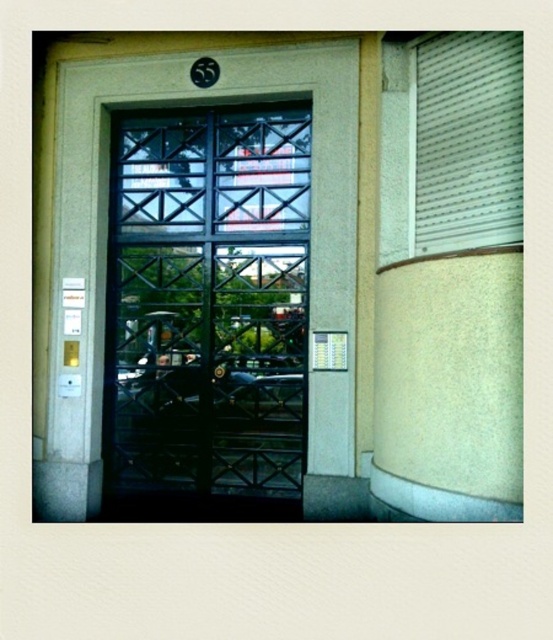
You are a delivery person trying to find the correct address. You see the beige textured pillar at right and the white plastic blinds at right. Which one is larger in size?

The beige textured pillar at right is bigger than the white plastic blinds at right.